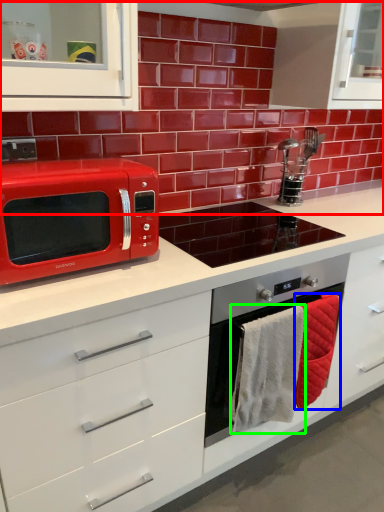
Question: Considering the real-world distances, which object is closest to brick (highlighted by a red box)? hand towel (highlighted by a blue box) or hand towel (highlighted by a green box).

Choices:
 (A) hand towel
 (B) hand towel

Answer: (A)